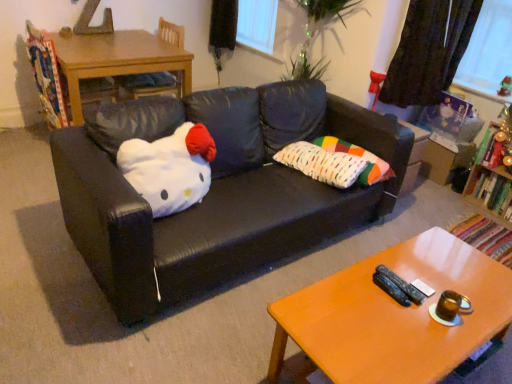
Question: Is wooden table at left taller or shorter than dark fabric curtain at upper right?

Choices:
 (A) short
 (B) tall

Answer: (A)

Question: Considering the relative positions of wooden table at left and dark fabric curtain at upper right in the image provided, is wooden table at left to the left or to the right of dark fabric curtain at upper right?

Choices:
 (A) right
 (B) left

Answer: (B)

Question: Which is farther from the multicolored fabric pillow at center, positioned as the 2th pillow in left-to-right order?

Choices:
 (A) wooden bookshelf at right
 (B) green matte plush at upper right, which is counted as the 1th toy, starting from the back
 (C) wooden table at left
 (D) shiny metallic candle at right, which ranks as the 1th toy in bottom-to-top order
 (E) white plush at center

Answer: (C)

Question: Based on their relative distances, which object is nearer to the wooden bookshelf at right?

Choices:
 (A) multicolored fabric pillow at center, which appears as the 2th pillow when viewed from the right
 (B) shiny metallic candle at right, the second toy from the back
 (C) orange wood coffee table at lower right
 (D) black leather couch at center
 (E) green matte plush at upper right, the second toy positioned from the front

Answer: (B)